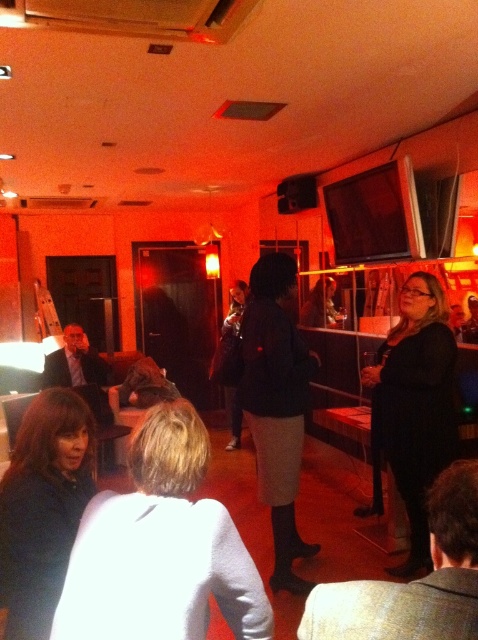
Is matte black jacket at lower left shorter than black leather jacket at lower center?

No.

Does matte black jacket at lower left have a lesser width compared to black leather jacket at lower center?

Yes.

Locate an element on the screen. This screenshot has width=478, height=640. matte black jacket at lower left is located at coordinates (43, 506).

Is point (388, 394) closer to viewer compared to point (447, 598)?

No, (388, 394) is further to viewer.

Between point (415, 404) and point (401, 609), which one is positioned behind?

Positioned behind is point (415, 404).

Is point (390, 449) positioned before point (397, 632)?

That is False.

Locate an element on the screen. black matte dress at center is located at coordinates (416, 403).

Is dark gray skirt at center further to camera compared to black leather jacket at lower center?

Yes, it is.

Which is behind, point (295, 435) or point (382, 608)?

Point (295, 435)

Is point (304, 582) farther from viewer compared to point (467, 621)?

Yes.

At what (x,y) coordinates should I click in order to perform the action: click on dark gray skirt at center. Please return your answer as a coordinate pair (x, y). Looking at the image, I should click on (276, 404).